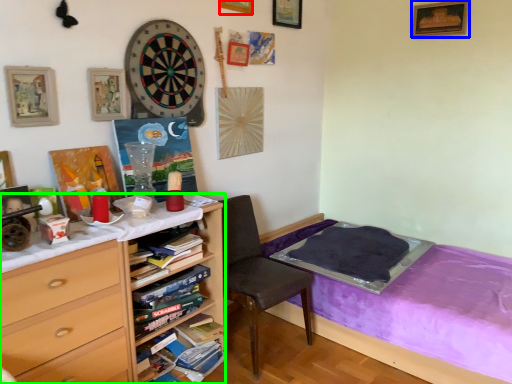
Question: Which object is the farthest from picture frame (highlighted by a red box)? Choose among these: picture frame (highlighted by a blue box) or desk (highlighted by a green box).

Choices:
 (A) picture frame
 (B) desk

Answer: (B)